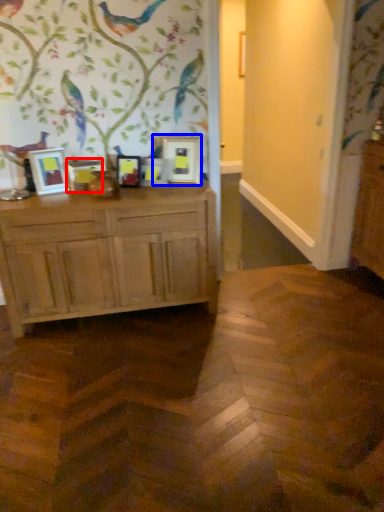
Question: Among these objects, which one is farthest to the camera, picture frame (highlighted by a red box) or picture frame (highlighted by a blue box)?

Choices:
 (A) picture frame
 (B) picture frame

Answer: (B)